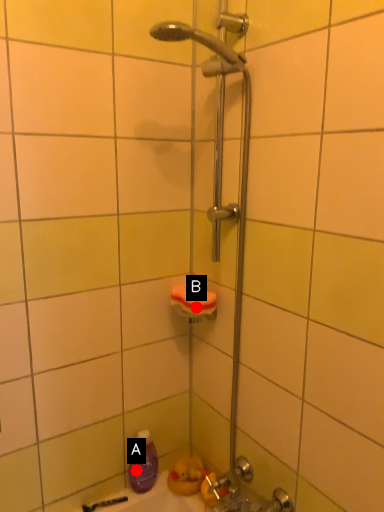
Question: Two points are circled on the image, labeled by A and B beside each circle. Which point appears farthest from the camera in this image?

Choices:
 (A) A is further
 (B) B is further

Answer: (A)